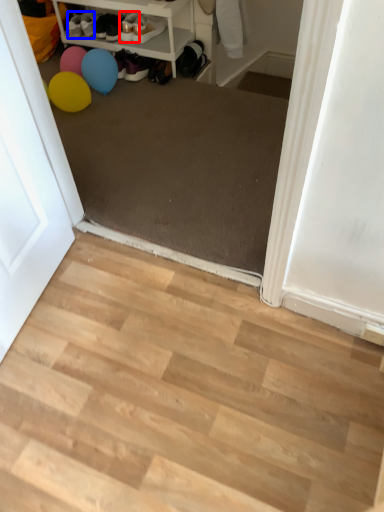
Question: Which of the following is the farthest to the observer, footwear (highlighted by a red box) or shoe (highlighted by a blue box)?

Choices:
 (A) footwear
 (B) shoe

Answer: (B)